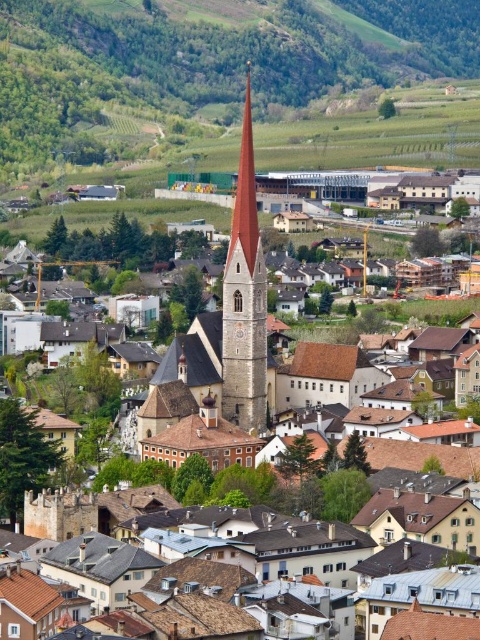
You are an architect planning to build a new observation deck in the town. You want the deck to have a clear view of both the green grassy hillside at upper center and the smooth stone church steeple at center. Based on their positions, which object should be placed closer to the edge of the deck to ensure both are visible?

The green grassy hillside at upper center is positioned on the right side of the smooth stone church steeple at center. To ensure both are visible from the observation deck, the deck should be positioned such that the smooth stone church steeple at center is closer to the edge, allowing the green grassy hillside at upper center to be seen to its right.

You are standing at the point marked by point (205,68) in the image. Looking around, you notice a tall church tower with a pointed red roof. In which direction should you walk to reach the church tower?

Since the point (205,68) is located on the green grassy hillside at upper center, and the church tower is described as rising prominently against the backdrop of the surrounding greenery, you should walk downward from the hillside towards the town in the foreground to reach the church tower.

You are standing at the point with coordinates point (238, 333) and want to walk to the point with coordinates point (397, 148). According to the scene, will the church tower with the pointed red roof block your path?

Point (397, 148) is behind point (238, 333), so the church tower with the pointed red roof will block your path to point (397, 148).